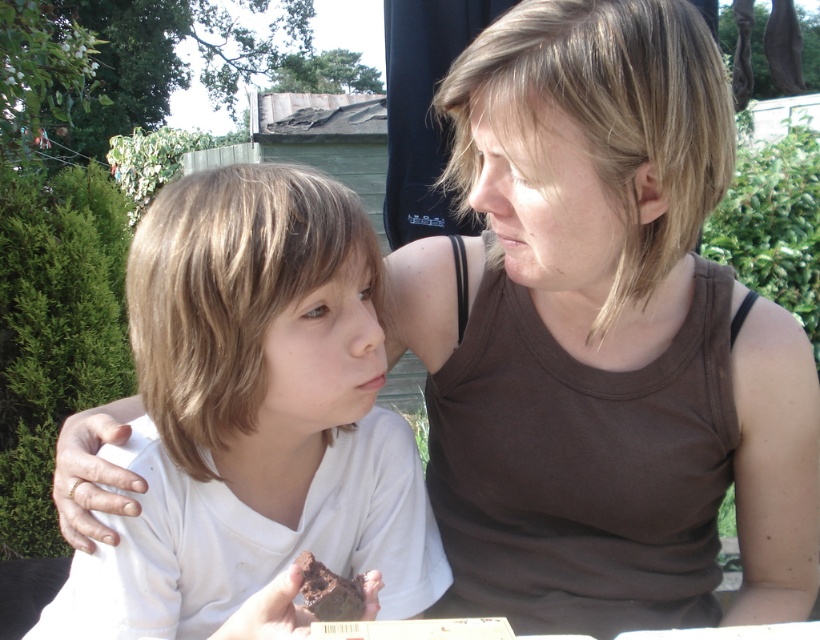
Based on the scene description, where is the brown matte tank top at upper center located in the image?

The brown matte tank top at upper center is located at point (607, 115).

You are a photographer adjusting your camera to capture the scene. You notice the brown matte tank top at upper center and the chocolate cake at lower center. Which object should you focus on first if you want to ensure both are in sharp focus, considering their positions?

The brown matte tank top at upper center is located above the chocolate cake at lower center, so focusing on the brown matte tank top at upper center first would help ensure both are in sharp focus since it is closer to the camera.